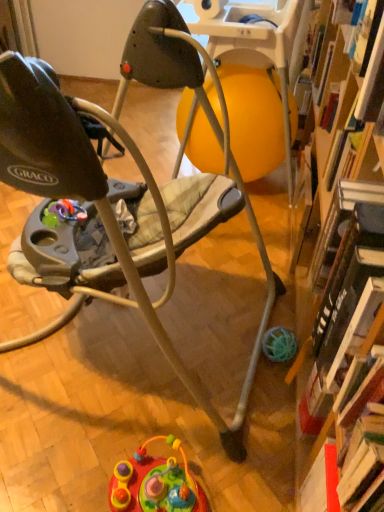
Identify the location of multicolored plastic toy at lower center. Image resolution: width=384 pixels, height=512 pixels. (155, 483).

Describe the element at coordinates (155, 483) in the screenshot. I see `multicolored plastic toy at lower center` at that location.

What do you see at coordinates (126, 199) in the screenshot?
I see `matte gray baby walker at center` at bounding box center [126, 199].

This screenshot has width=384, height=512. I want to click on matte gray baby walker at center, so click(x=126, y=199).

Find the location of a particular element. multicolored plastic toy at lower center is located at coordinates tap(155, 483).

Based on the photo, is matte gray baby walker at center to the left of multicolored plastic toy at lower center from the viewer's perspective?

Yes, matte gray baby walker at center is to the left of multicolored plastic toy at lower center.

Does matte gray baby walker at center lie behind multicolored plastic toy at lower center?

No, it is not.

Does point (158, 49) lie in front of point (179, 509)?

That is False.

From the picture: From the image's perspective, which is above, matte gray baby walker at center or multicolored plastic toy at lower center?

matte gray baby walker at center appears higher in the image.

From a real-world perspective, which object rests below the other?

multicolored plastic toy at lower center, from a real-world perspective.

Does matte gray baby walker at center have a lesser width compared to multicolored plastic toy at lower center?

Incorrect, the width of matte gray baby walker at center is not less than that of multicolored plastic toy at lower center.

Can you confirm if matte gray baby walker at center is shorter than multicolored plastic toy at lower center?

Incorrect, the height of matte gray baby walker at center does not fall short of that of multicolored plastic toy at lower center.

In terms of size, does matte gray baby walker at center appear bigger or smaller than multicolored plastic toy at lower center?

In the image, matte gray baby walker at center appears to be larger than multicolored plastic toy at lower center.

Could multicolored plastic toy at lower center be considered to be inside matte gray baby walker at center?

No, multicolored plastic toy at lower center is not surrounded by matte gray baby walker at center.

Is matte gray baby walker at center next to multicolored plastic toy at lower center and touching it?

No, matte gray baby walker at center is not making contact with multicolored plastic toy at lower center.

Could you tell me if matte gray baby walker at center is turned towards multicolored plastic toy at lower center?

No, matte gray baby walker at center is not aimed at multicolored plastic toy at lower center.

Can you tell me how much matte gray baby walker at center and multicolored plastic toy at lower center differ in facing direction?

8.43 degrees separate the facing orientations of matte gray baby walker at center and multicolored plastic toy at lower center.

The height and width of the screenshot is (512, 384). I want to click on toy on the right of matte gray baby walker at center, so click(x=155, y=483).

Does multicolored plastic toy at lower center appear on the right side of matte gray baby walker at center?

Yes, multicolored plastic toy at lower center is to the right of matte gray baby walker at center.

Consider the image. Relative to matte gray baby walker at center, is multicolored plastic toy at lower center in front or behind?

Clearly, multicolored plastic toy at lower center is behind matte gray baby walker at center.

Which is in front, point (127, 474) or point (143, 275)?

The point (143, 275) is in front.

From the image's perspective, is multicolored plastic toy at lower center over matte gray baby walker at center?

Actually, multicolored plastic toy at lower center appears below matte gray baby walker at center in the image.

From a real-world perspective, is multicolored plastic toy at lower center on matte gray baby walker at center?

Actually, multicolored plastic toy at lower center is physically below matte gray baby walker at center in the real world.

Does multicolored plastic toy at lower center have a greater width compared to matte gray baby walker at center?

Incorrect, the width of multicolored plastic toy at lower center does not surpass that of matte gray baby walker at center.

Which of these two, multicolored plastic toy at lower center or matte gray baby walker at center, stands shorter?

multicolored plastic toy at lower center is shorter.

Between multicolored plastic toy at lower center and matte gray baby walker at center, which one has larger size?

Bigger between the two is matte gray baby walker at center.

Is matte gray baby walker at center surrounded by multicolored plastic toy at lower center?

No, multicolored plastic toy at lower center does not contain matte gray baby walker at center.

Is multicolored plastic toy at lower center directly adjacent to matte gray baby walker at center?

multicolored plastic toy at lower center and matte gray baby walker at center are clearly separated.

Could you tell me if multicolored plastic toy at lower center is turned towards matte gray baby walker at center?

No, multicolored plastic toy at lower center is not facing towards matte gray baby walker at center.

This screenshot has width=384, height=512. What are the coordinates of `chair in front of the multicolored plastic toy at lower center` in the screenshot? It's located at (126, 199).

Where is `chair on the left of the multicolored plastic toy at lower center`? This screenshot has height=512, width=384. chair on the left of the multicolored plastic toy at lower center is located at coordinates (126, 199).

What are the coordinates of `toy lying behind the matte gray baby walker at center` in the screenshot? It's located at (155, 483).